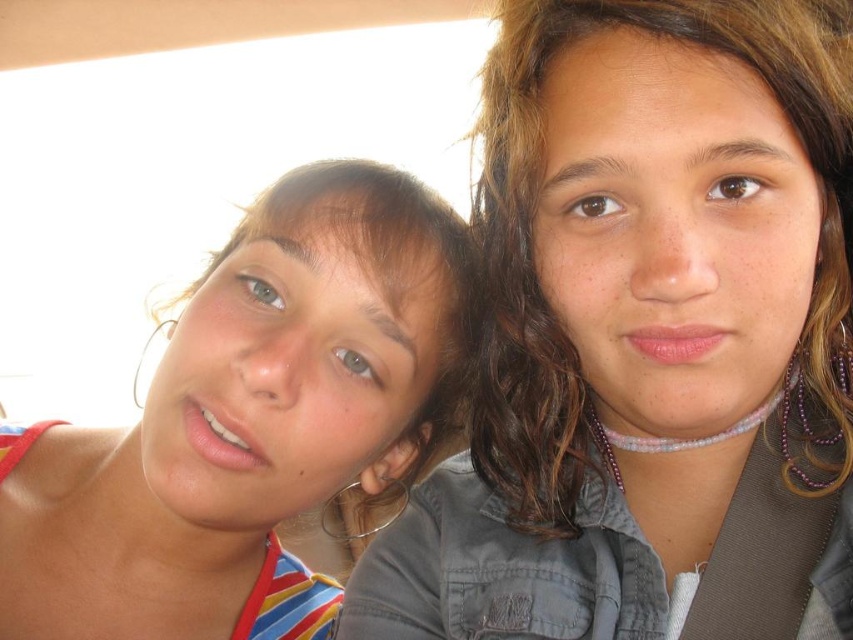
Question: Does matte gray shirt at upper right appear on the left side of matte striped tank top at left?

Choices:
 (A) yes
 (B) no

Answer: (B)

Question: Can you confirm if matte gray shirt at upper right is positioned to the right of matte striped tank top at left?

Choices:
 (A) no
 (B) yes

Answer: (B)

Question: Does matte gray shirt at upper right have a larger size compared to matte striped tank top at left?

Choices:
 (A) no
 (B) yes

Answer: (A)

Question: Which object appears farthest from the camera in this image?

Choices:
 (A) matte striped tank top at left
 (B) matte gray shirt at upper right

Answer: (A)